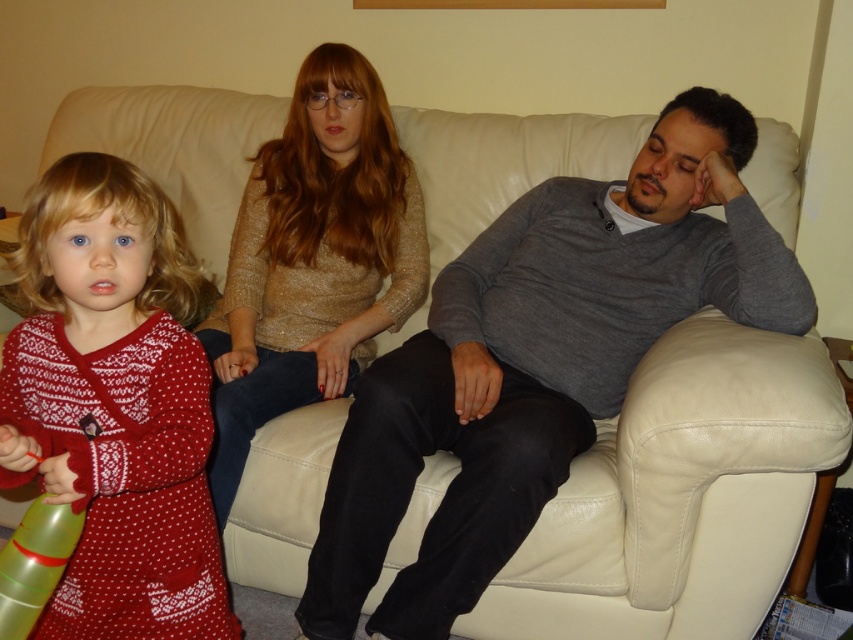
Question: Which point is farther to the camera?

Choices:
 (A) (148, 244)
 (B) (550, 196)

Answer: (B)

Question: Does red knit dress at left have a lesser width compared to shiny gold sweater at center?

Choices:
 (A) no
 (B) yes

Answer: (B)

Question: Is gray matte sweater at center bigger than shiny gold sweater at center?

Choices:
 (A) no
 (B) yes

Answer: (B)

Question: Which object is positioned closest to the red knit dress at left?

Choices:
 (A) gray matte sweater at center
 (B) shiny gold sweater at center

Answer: (B)

Question: Can you confirm if gray matte sweater at center is bigger than shiny gold sweater at center?

Choices:
 (A) no
 (B) yes

Answer: (B)

Question: Which object is closer to the camera taking this photo?

Choices:
 (A) shiny gold sweater at center
 (B) gray matte sweater at center
 (C) red knit dress at left

Answer: (C)